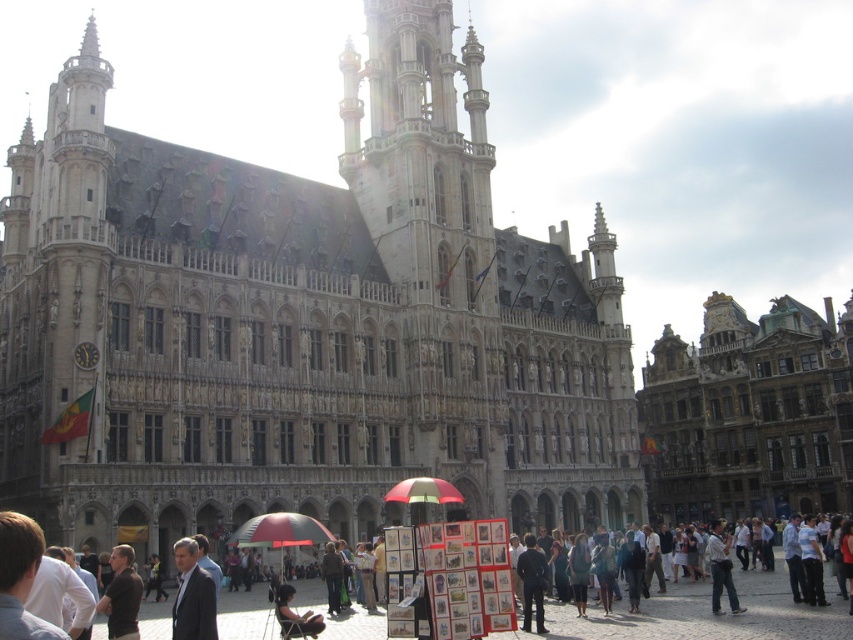
Can you confirm if stone gothic building at center is positioned above light brown leather jacket at center?

Indeed, stone gothic building at center is positioned over light brown leather jacket at center.

Which is in front, point (177, 412) or point (708, 556)?

Positioned in front is point (177, 412).

Is point (294, 301) positioned behind point (721, 568)?

Yes, point (294, 301) is farther from viewer.

The image size is (853, 640). I want to click on stone gothic building at center, so click(x=300, y=321).

Does dark blue jeans at center appear under dark brown leather jacket at lower center?

Yes, dark blue jeans at center is below dark brown leather jacket at lower center.

Is dark blue jeans at center further to camera compared to dark brown leather jacket at lower center?

Yes, dark blue jeans at center is further from the viewer.

Describe the element at coordinates (532, 582) in the screenshot. The height and width of the screenshot is (640, 853). I see `dark blue jeans at center` at that location.

Find the location of a particular element. This screenshot has width=853, height=640. dark blue jeans at center is located at coordinates (532, 582).

Which is in front, point (444, 396) or point (643, 612)?

Point (643, 612)

Does stone gothic building at center have a greater height compared to dark gray clothing at lower right?

Yes, stone gothic building at center is taller than dark gray clothing at lower right.

Between point (115, 333) and point (616, 612), which one is positioned behind?

The point (115, 333) is more distant.

This screenshot has height=640, width=853. I want to click on stone gothic building at center, so click(x=300, y=321).